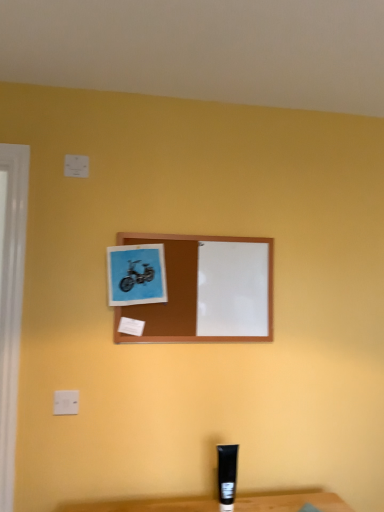
Question: Does white plastic electric outlet at upper left have a lesser width compared to blue paper at upper center, arranged as the first picture frame when viewed from the left?

Choices:
 (A) yes
 (B) no

Answer: (A)

Question: Is white plastic electric outlet at upper left behind blue paper at upper center, which appears as the 2th picture frame when viewed from the right?

Choices:
 (A) no
 (B) yes

Answer: (A)

Question: From a real-world perspective, is white plastic electric outlet at upper left located higher than blue paper at upper center, arranged as the first picture frame when viewed from the left?

Choices:
 (A) yes
 (B) no

Answer: (B)

Question: Considering the relative positions of white plastic electric outlet at upper left and blue paper at upper center, arranged as the first picture frame when viewed from the left, in the image provided, is white plastic electric outlet at upper left in front of blue paper at upper center, arranged as the first picture frame when viewed from the left,?

Choices:
 (A) no
 (B) yes

Answer: (B)

Question: Are white plastic electric outlet at upper left and blue paper at upper center, arranged as the first picture frame when viewed from the left, located far from each other?

Choices:
 (A) yes
 (B) no

Answer: (B)

Question: Can you confirm if white plastic electric outlet at upper left is bigger than blue paper at upper center, which appears as the 2th picture frame when viewed from the right?

Choices:
 (A) no
 (B) yes

Answer: (A)

Question: Does brown wooden picture frame at center, which is the 2th picture frame in left-to-right order, have a larger size compared to blue paper at upper center, arranged as the first picture frame when viewed from the left?

Choices:
 (A) no
 (B) yes

Answer: (B)

Question: Considering the relative sizes of brown wooden picture frame at center, which is the 2th picture frame in left-to-right order, and blue paper at upper center, which appears as the 2th picture frame when viewed from the right, in the image provided, is brown wooden picture frame at center, which is the 2th picture frame in left-to-right order, shorter than blue paper at upper center, which appears as the 2th picture frame when viewed from the right,?

Choices:
 (A) no
 (B) yes

Answer: (A)

Question: Is brown wooden picture frame at center, acting as the first picture frame starting from the right, next to blue paper at upper center, which appears as the 2th picture frame when viewed from the right?

Choices:
 (A) yes
 (B) no

Answer: (B)

Question: Does brown wooden picture frame at center, which is the 2th picture frame in left-to-right order, appear on the right side of blue paper at upper center, arranged as the first picture frame when viewed from the left?

Choices:
 (A) yes
 (B) no

Answer: (A)

Question: From the image's perspective, is brown wooden picture frame at center, which is the 2th picture frame in left-to-right order, located above blue paper at upper center, which appears as the 2th picture frame when viewed from the right?

Choices:
 (A) yes
 (B) no

Answer: (B)

Question: Is brown wooden picture frame at center, acting as the first picture frame starting from the right, oriented towards blue paper at upper center, arranged as the first picture frame when viewed from the left?

Choices:
 (A) no
 (B) yes

Answer: (B)

Question: Is brown wooden picture frame at center, acting as the first picture frame starting from the right, smaller than white plastic electric outlet at upper left?

Choices:
 (A) yes
 (B) no

Answer: (B)